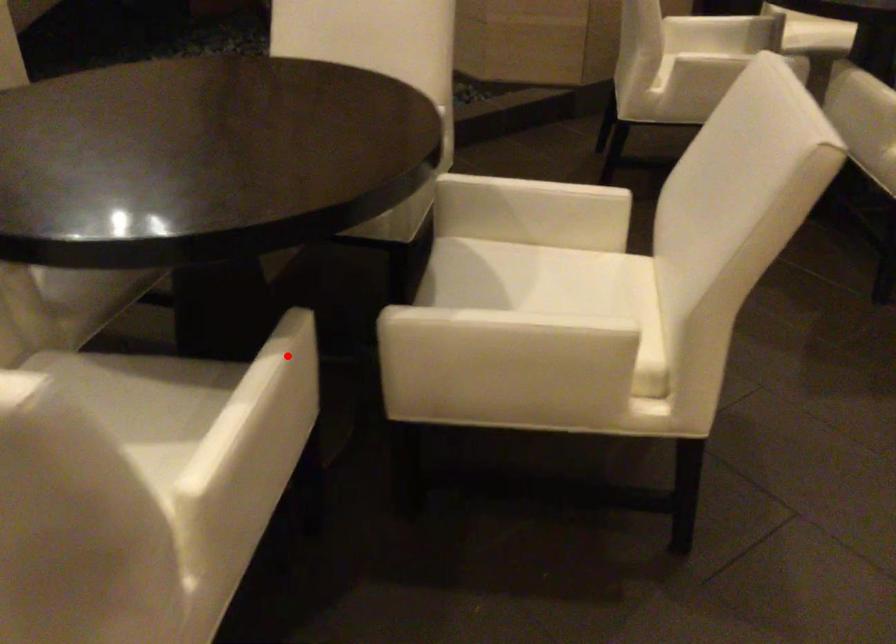
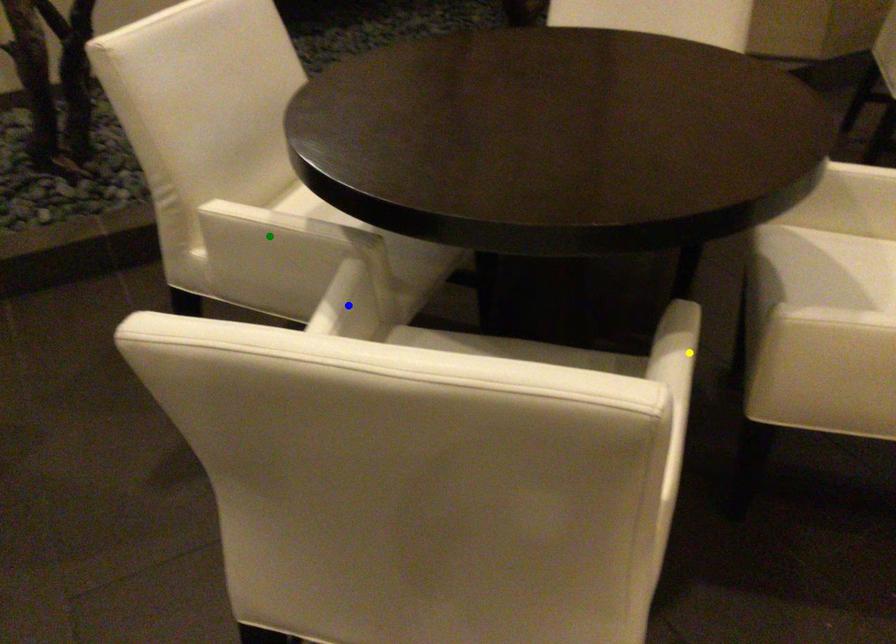
Question: I am providing you with two images of the same scene from different viewpoints. A red point is marked on the first image. You are given multiple points on the second image. Can you choose the point in image 2 that corresponds to the point in image 1?

Choices:
 (A) yellow point
 (B) blue point
 (C) green point

Answer: (A)